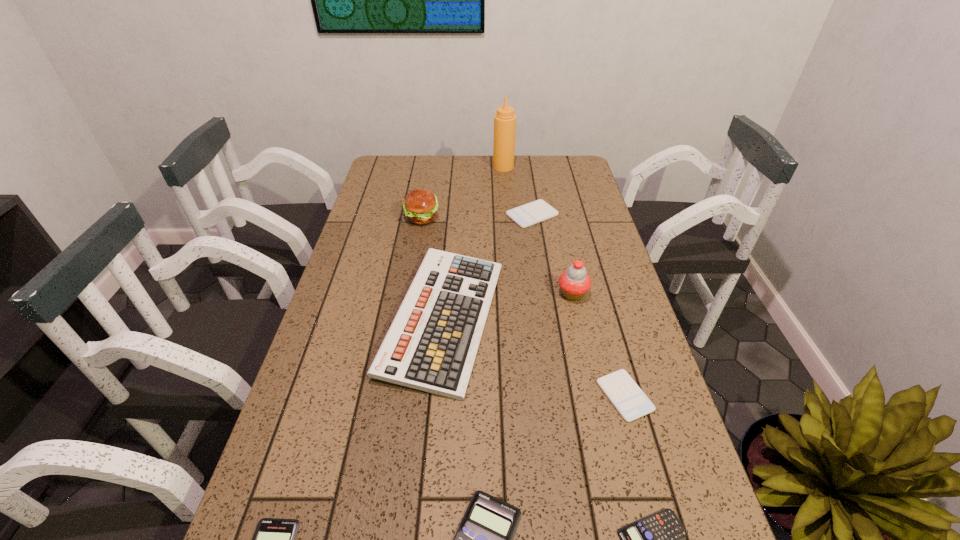
Locate which calculator is the fourth closest to the hamburger. Please provide its 2D coordinates. Your answer should be formatted as a tuple, i.e. [(x, y)], where the tuple contains the x and y coordinates of a point satisfying the conditions above.

[(274, 539)]

Identify which blue calculator is located as the nearest to the shortest calculator. Please provide its 2D coordinates. Your answer should be formatted as a tuple, i.e. [(x, y)], where the tuple contains the x and y coordinates of a point satisfying the conditions above.

[(484, 539)]

The width and height of the screenshot is (960, 540). Identify the location of the second closest blue calculator to the sixth shortest object. (274, 539).

Where is `free spot that satisfies the following two spatial constraints: 1. on the back side of the third tallest object; 2. on the right side of the tallest object`? This screenshot has height=540, width=960. free spot that satisfies the following two spatial constraints: 1. on the back side of the third tallest object; 2. on the right side of the tallest object is located at coordinates (430, 167).

You are a GUI agent. You are given a task and a screenshot of the screen. Output one action in this format:
    pyautogui.click(x=<x>, y=<y>)
    Task: Click on the free region that satisfies the following two spatial constraints: 1. on the back side of the sixth shortest object; 2. on the right side of the condiment
    
    Given the screenshot: What is the action you would take?
    pyautogui.click(x=456, y=167)

Image resolution: width=960 pixels, height=540 pixels. In order to click on vacant space that satisfies the following two spatial constraints: 1. on the front side of the nearer white calculator; 2. on the left side of the seventh shortest object in this screenshot , I will do `click(391, 396)`.